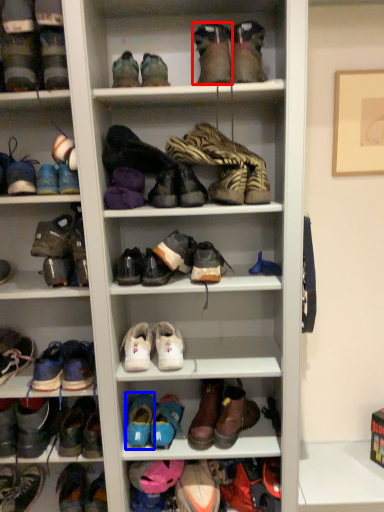
Question: Which of the following is the closest to the observer, shoe (highlighted by a red box) or shoe (highlighted by a blue box)?

Choices:
 (A) shoe
 (B) shoe

Answer: (A)